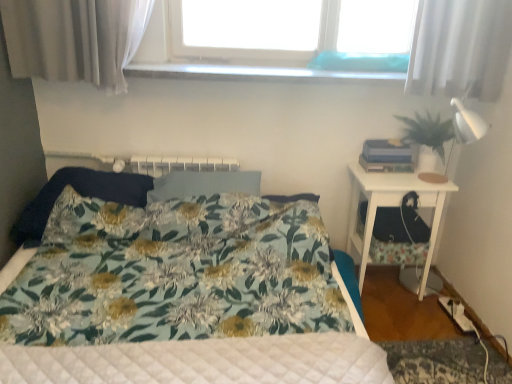
Question: Which direction should I rotate to look at fluffy fabric pillow at center, placed as the 2th pillow when sorted from left to right, — up or down?

Choices:
 (A) up
 (B) down

Answer: (A)

Question: Is green matte plant at right completely or partially inside fluffy fabric pillow at center, which is the first pillow in right-to-left order?

Choices:
 (A) no
 (B) yes

Answer: (A)

Question: Does fluffy fabric pillow at center, placed as the 2th pillow when sorted from left to right, lie behind green matte plant at right?

Choices:
 (A) no
 (B) yes

Answer: (A)

Question: Is fluffy fabric pillow at center, which is the first pillow in right-to-left order, positioned beyond the bounds of green matte plant at right?

Choices:
 (A) no
 (B) yes

Answer: (B)

Question: Can you confirm if fluffy fabric pillow at center, placed as the 2th pillow when sorted from left to right, is bigger than green matte plant at right?

Choices:
 (A) yes
 (B) no

Answer: (A)

Question: Is fluffy fabric pillow at center, which is the first pillow in right-to-left order, facing towards green matte plant at right?

Choices:
 (A) no
 (B) yes

Answer: (A)

Question: Considering the relative positions of fluffy fabric pillow at center, placed as the 2th pillow when sorted from left to right, and green matte plant at right in the image provided, is fluffy fabric pillow at center, placed as the 2th pillow when sorted from left to right, to the right of green matte plant at right from the viewer's perspective?

Choices:
 (A) no
 (B) yes

Answer: (A)

Question: Considering the relative sizes of dark blue fabric pillow at left, which appears as the 2th pillow when viewed from the right, and green matte plant at right in the image provided, is dark blue fabric pillow at left, which appears as the 2th pillow when viewed from the right, wider than green matte plant at right?

Choices:
 (A) no
 (B) yes

Answer: (B)

Question: From a real-world perspective, does dark blue fabric pillow at left, which appears as the 2th pillow when viewed from the right, sit lower than green matte plant at right?

Choices:
 (A) no
 (B) yes

Answer: (B)

Question: Does dark blue fabric pillow at left, the first pillow when ordered from left to right, have a smaller size compared to green matte plant at right?

Choices:
 (A) yes
 (B) no

Answer: (B)

Question: Does dark blue fabric pillow at left, the first pillow when ordered from left to right, come behind green matte plant at right?

Choices:
 (A) no
 (B) yes

Answer: (A)

Question: Would you say dark blue fabric pillow at left, the first pillow when ordered from left to right, is outside green matte plant at right?

Choices:
 (A) no
 (B) yes

Answer: (B)

Question: From the image's perspective, is dark blue fabric pillow at left, the first pillow when ordered from left to right, located above green matte plant at right?

Choices:
 (A) yes
 (B) no

Answer: (B)

Question: Does white glossy nightstand at right come behind dark blue fabric pillow at left, which appears as the 2th pillow when viewed from the right?

Choices:
 (A) yes
 (B) no

Answer: (A)